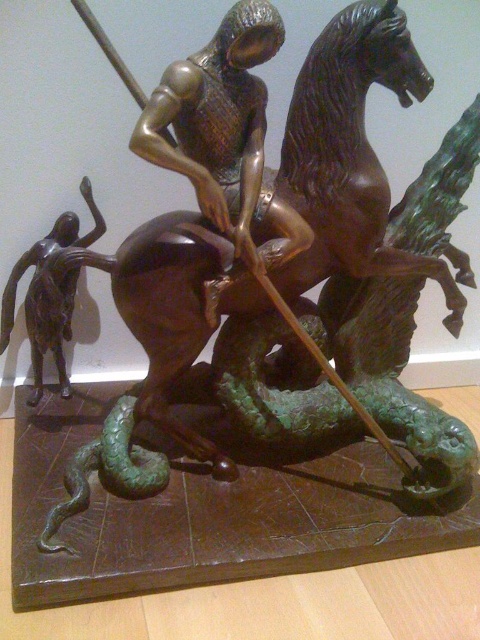
You are an art conservator examining the sculpture. You need to determine which bronze figure, the bronze figure at center or the bronze figure at left, requires a taller support base to prevent tipping. Based on their heights, which one should you prioritize?

The bronze figure at left is taller than the bronze figure at center, so it would require a taller support base to prevent tipping.

You are an art conservator inspecting the bronze sculpture. You notice two points of concern on the sculpture labeled as point (216, 166) and point (16, 284). Which point is more likely to be accessible for immediate repair without moving the sculpture?

Point (216, 166) is closer to the viewer than point (16, 284), so it is more accessible for immediate repair without moving the sculpture.

Looking at this image, you are an art conservator examining the sculpture. You need to clean the bronze figure at center and the bronze figure at left. Which bronze figure should you clean first if you want to start with the one that is closer to the front?

The bronze figure at center is in front of bronze figure at left, so you should clean the bronze figure at center first since it is closer to the front.